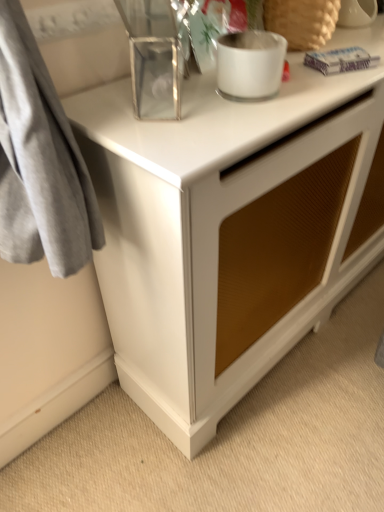
Where is `free space in front of white glossy cabinet at center`? The height and width of the screenshot is (512, 384). free space in front of white glossy cabinet at center is located at coordinates (295, 416).